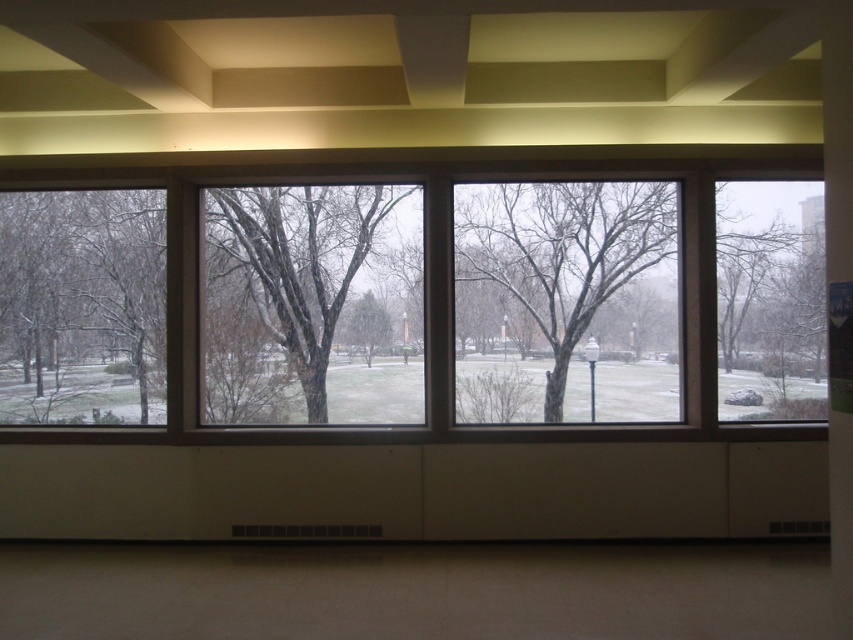
You are standing in a room with a clear glass window at center and bare branches at center outside. If you want to look at the branches closer, which object should you move towards?

A: To look at the bare branches at center closer, you should move towards the clear glass window at center because it is the transparent surface through which you can view the branches outside.

You are trying to determine if the clear glass window at center can provide a clear view of the bare branches at center outside. Based on their positions, is this possible?

The clear glass window at center is located above the bare branches at center, so it can provide a clear view of them as long as there are no obstructions between the window and the branches.

You are standing in the room and want to look outside through the clear glass window at center. However, there is a green matte tree at center blocking your view. Which direction should you move to see through the window?

The clear glass window at center is to the left of the green matte tree at center. To see through the window, you should move to the left side of the green matte tree at center so that the window is no longer blocked.